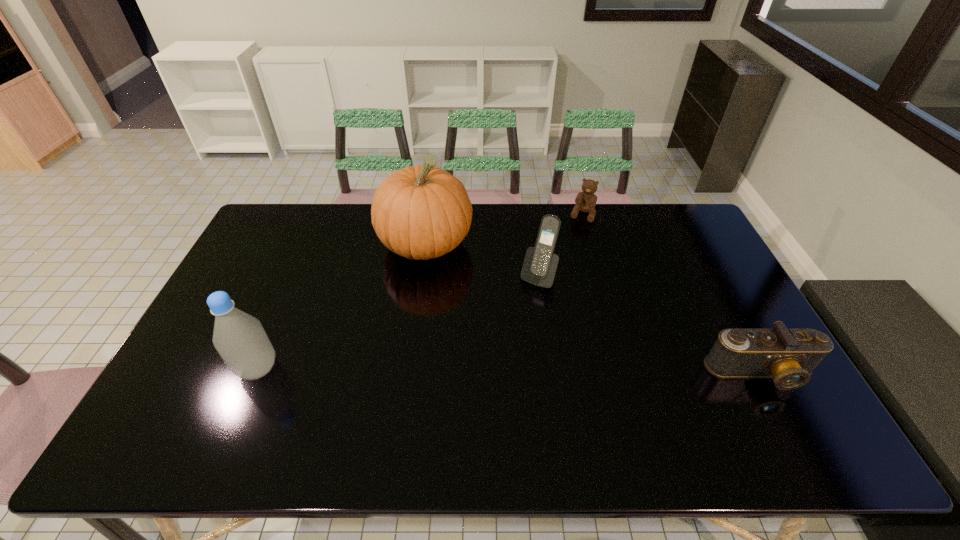
The image size is (960, 540). In order to click on free area in between the third object from left to right and the rightmost object in this screenshot , I will do click(x=649, y=325).

Identify which object is the third nearest to the rightmost object. Please provide its 2D coordinates. Your answer should be formatted as a tuple, i.e. [(x, y)], where the tuple contains the x and y coordinates of a point satisfying the conditions above.

[(421, 212)]

Identify which object is located as the fourth nearest to the rightmost object. Please provide its 2D coordinates. Your answer should be formatted as a tuple, i.e. [(x, y)], where the tuple contains the x and y coordinates of a point satisfying the conditions above.

[(240, 339)]

This screenshot has height=540, width=960. I want to click on vacant space that satisfies the following two spatial constraints: 1. on the back side of the third shortest object; 2. on the right side of the teddy bear, so click(x=530, y=215).

The width and height of the screenshot is (960, 540). I want to click on vacant space that satisfies the following two spatial constraints: 1. on the back side of the fourth shortest object; 2. on the right side of the second object from left to right, so click(x=311, y=244).